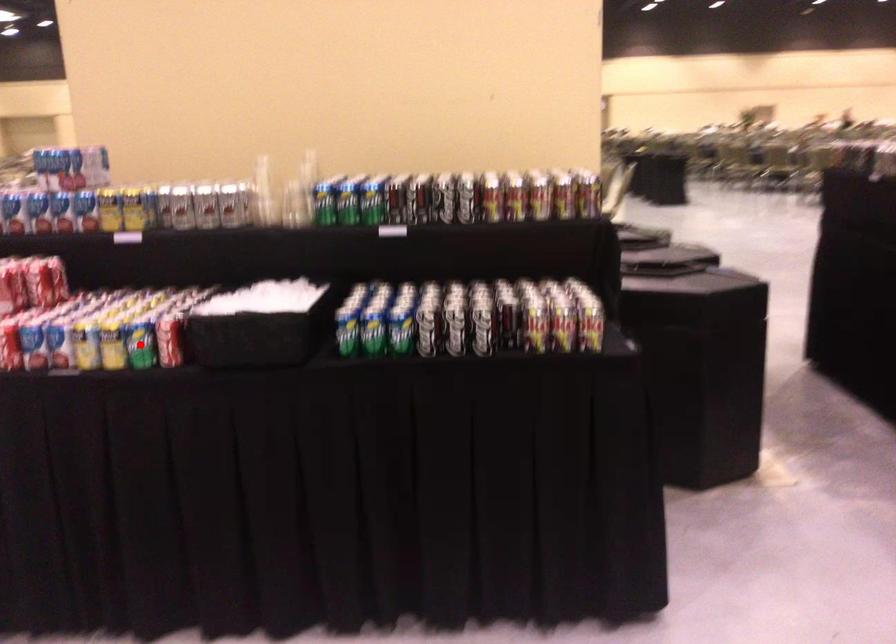
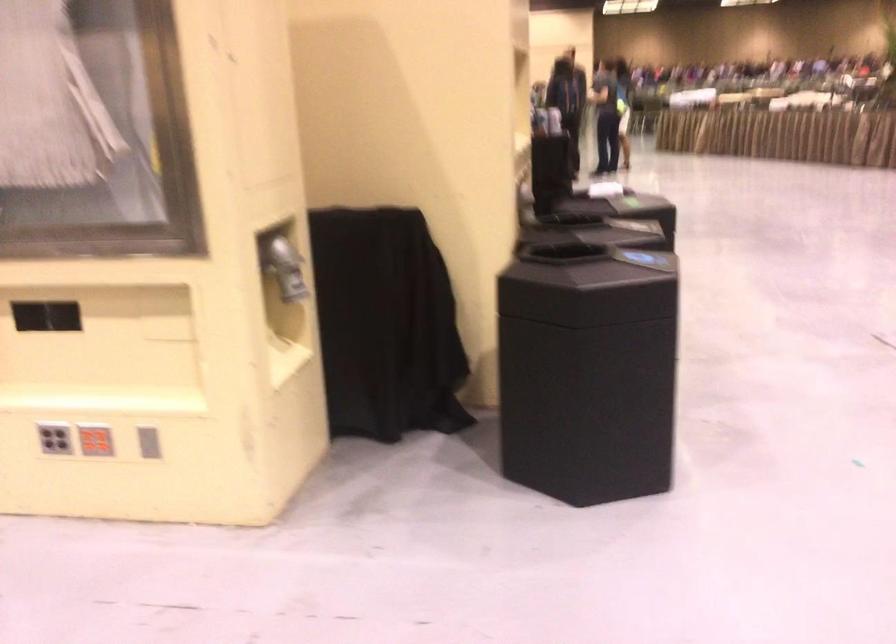
Question: I am providing you with two images of the same scene from different viewpoints. A red point is marked on the first image. At the location where the point appears in image 1, is it still visible in image 2?

Choices:
 (A) Yes
 (B) No

Answer: (B)